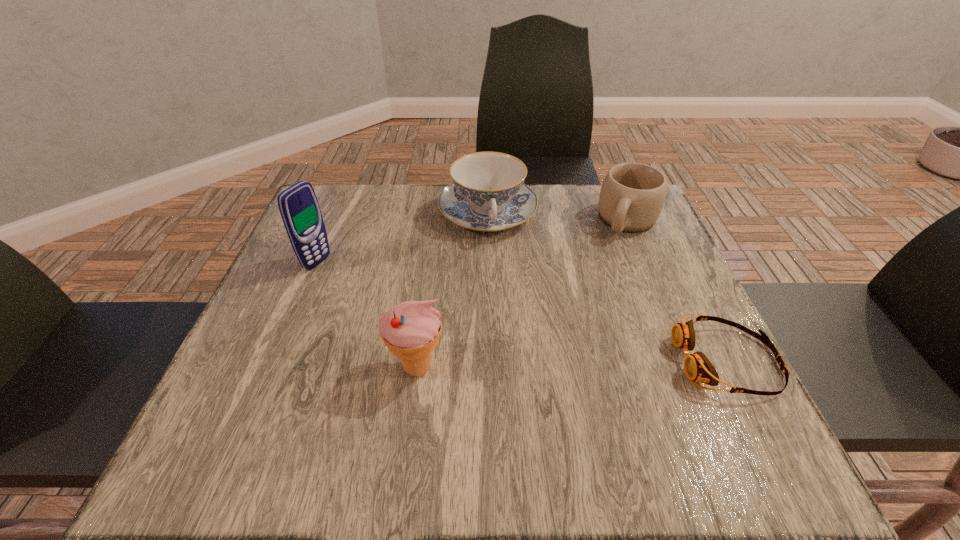
You are a GUI agent. You are given a task and a screenshot of the screen. Output one action in this format:
    pyautogui.click(x=<x>, y=<y>)
    Task: Click on the vacant space at the right edge
    Image resolution: width=960 pixels, height=540 pixels.
    Given the screenshot: What is the action you would take?
    pyautogui.click(x=624, y=289)

In the image, there is a desktop. At what (x,y) coordinates should I click in order to perform the action: click on free space at the near left corner. Please return your answer as a coordinate pair (x, y). The image size is (960, 540). Looking at the image, I should click on (252, 415).

The image size is (960, 540). In order to click on vacant position at the near right corner of the desktop in this screenshot , I will do `click(732, 377)`.

I want to click on blank region between the mug and the cellular telephone, so tap(472, 241).

Where is `free spot between the shortest object and the chinaware`? Image resolution: width=960 pixels, height=540 pixels. free spot between the shortest object and the chinaware is located at coordinates (608, 287).

Where is `vacant region between the chinaware and the icecream`? The width and height of the screenshot is (960, 540). vacant region between the chinaware and the icecream is located at coordinates (452, 291).

Where is `free area in between the cellular telephone and the icecream`? The width and height of the screenshot is (960, 540). free area in between the cellular telephone and the icecream is located at coordinates (368, 315).

Image resolution: width=960 pixels, height=540 pixels. I want to click on free spot between the shortest object and the icecream, so click(572, 364).

Locate an element on the screen. free space between the chinaware and the goggles is located at coordinates (x=608, y=287).

This screenshot has width=960, height=540. In order to click on vacant area that lies between the chinaware and the mug in this screenshot , I will do `click(558, 217)`.